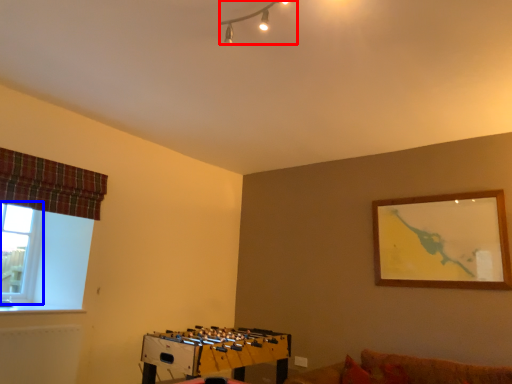
Question: Among these objects, which one is nearest to the camera, lamp (highlighted by a red box) or window (highlighted by a blue box)?

Choices:
 (A) lamp
 (B) window

Answer: (A)